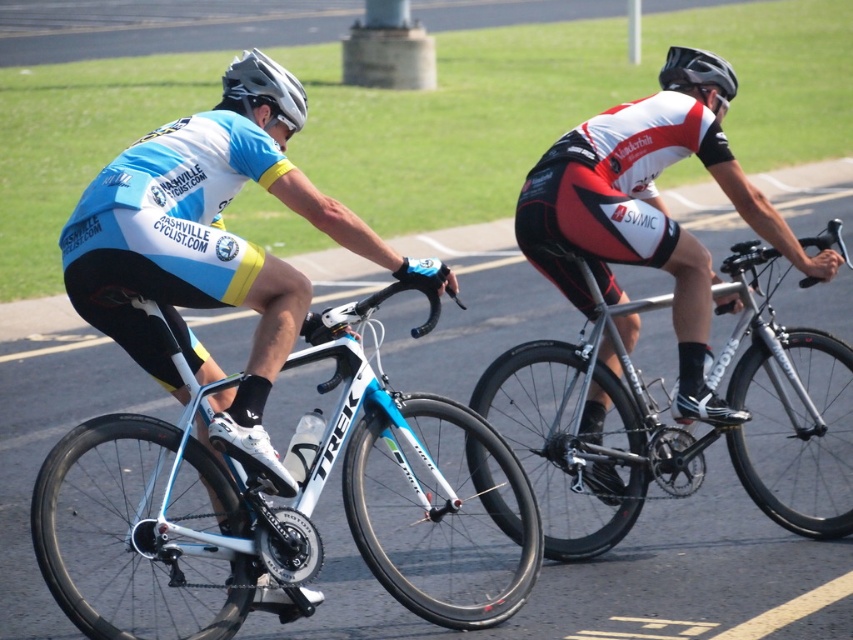
Question: Does matte white bicycle at center have a greater width compared to matte gray helmet at upper left?

Choices:
 (A) yes
 (B) no

Answer: (A)

Question: Which of the following is the farthest from the observer?

Choices:
 (A) (833, 337)
 (B) (347, 394)
 (C) (234, 74)
 (D) (675, 58)

Answer: (D)

Question: Observing the image, what is the correct spatial positioning of matte white bicycle at center in reference to matte gray helmet at upper left?

Choices:
 (A) above
 (B) below

Answer: (B)

Question: Among these points, which one is farthest from the camera?

Choices:
 (A) (375, 300)
 (B) (494, 388)

Answer: (B)

Question: Based on their relative distances, which object is farther from the matte white bicycle at center?

Choices:
 (A) black matte helmet at upper center
 (B) matte gray helmet at upper left

Answer: (A)

Question: From the image, what is the correct spatial relationship of matte white bicycle at center in relation to black matte helmet at upper center?

Choices:
 (A) left
 (B) right

Answer: (A)